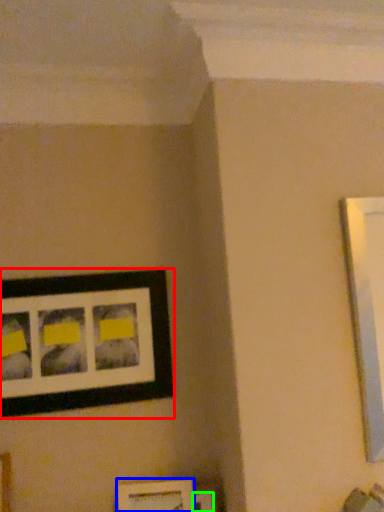
Question: Which object is positioned farthest from picture frame (highlighted by a red box)? Select from picture frame (highlighted by a blue box) and picture frame (highlighted by a green box).

Choices:
 (A) picture frame
 (B) picture frame

Answer: (B)